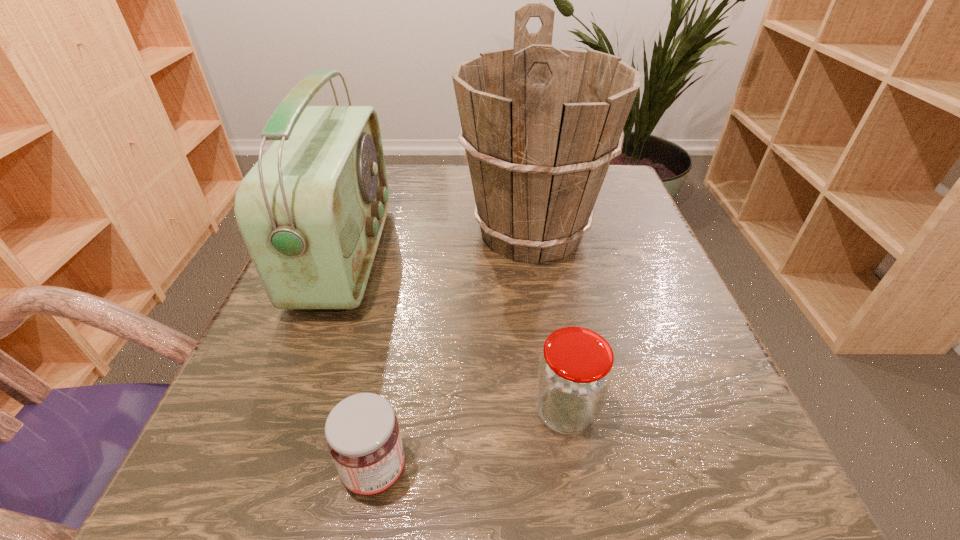
Locate an element on the screen. The height and width of the screenshot is (540, 960). vacant area between the jam and the jar is located at coordinates (470, 441).

Locate an element on the screen. This screenshot has height=540, width=960. free space between the bucket and the second tallest object is located at coordinates (439, 244).

This screenshot has width=960, height=540. Find the location of `free space between the shortest object and the jar`. free space between the shortest object and the jar is located at coordinates (470, 441).

The height and width of the screenshot is (540, 960). What are the coordinates of `vacant space that is in between the jar and the second tallest object` in the screenshot? It's located at (455, 333).

I want to click on the second closest object to the second tallest object, so pos(363,437).

What are the coordinates of `the third closest object relative to the tallest object` in the screenshot? It's located at (363, 437).

Identify the location of free space that satisfies the following two spatial constraints: 1. on the front panel of the leftmost object; 2. on the back side of the jar. (287, 411).

Locate an element on the screen. free location that satisfies the following two spatial constraints: 1. on the front panel of the leftmost object; 2. on the back side of the shortest object is located at coordinates (265, 471).

Identify the location of vacant space that satisfies the following two spatial constraints: 1. on the front panel of the second object from left to right; 2. on the left side of the second tallest object. This screenshot has width=960, height=540. (265, 471).

Find the location of a particular element. The width and height of the screenshot is (960, 540). free space that satisfies the following two spatial constraints: 1. on the front panel of the leftmost object; 2. on the back side of the jar is located at coordinates (287, 411).